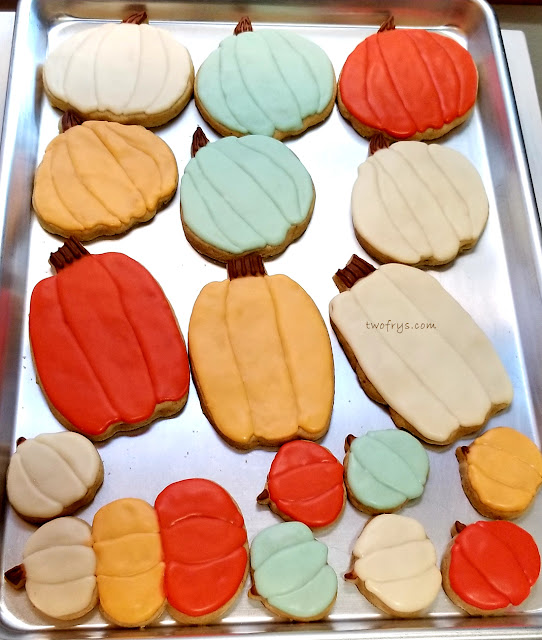
This screenshot has height=640, width=542. I want to click on silver baking sheet, so click(14, 624), click(437, 497), click(508, 297), click(299, 152), click(16, 237), click(57, 9), click(311, 10), click(481, 43), click(156, 467).